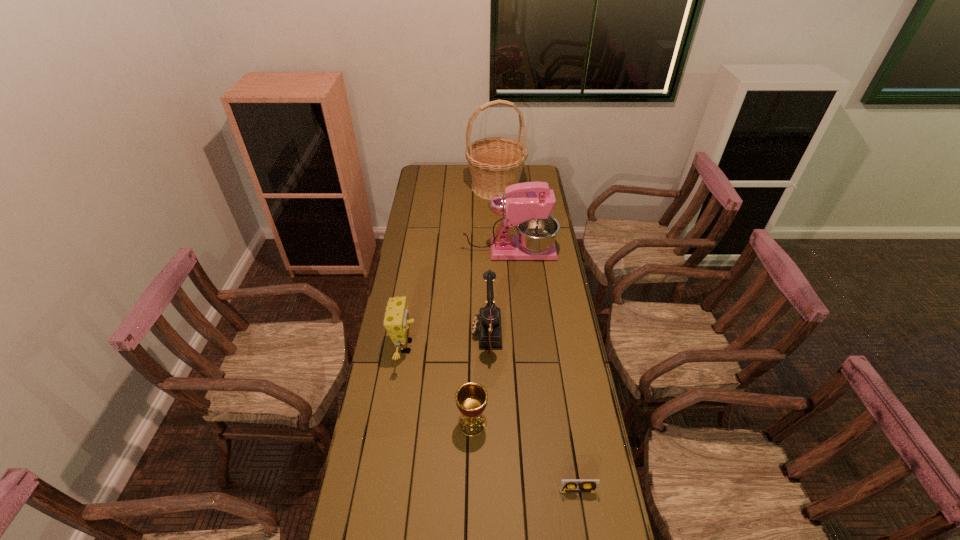
Locate an element on the screen. vacant space that satisfies the following two spatial constraints: 1. on the face of the leftmost object; 2. on the left side of the chalice is located at coordinates (394, 423).

The height and width of the screenshot is (540, 960). In order to click on vacant region that satisfies the following two spatial constraints: 1. on the face of the fourth tallest object; 2. on the right side of the fifth farthest object in this screenshot , I will do `click(394, 423)`.